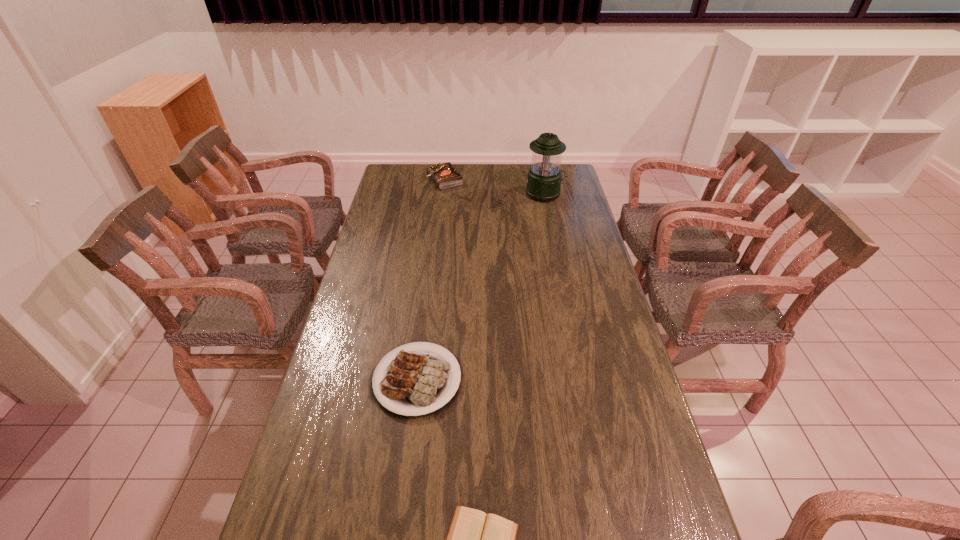
The height and width of the screenshot is (540, 960). In order to click on free point between the third farthest object and the tallest object in this screenshot , I will do `click(481, 287)`.

Where is `unoccupied position between the third shortest object and the third farthest object`? unoccupied position between the third shortest object and the third farthest object is located at coordinates (431, 280).

Where is `free space between the second tallest object and the rightmost object`? This screenshot has width=960, height=540. free space between the second tallest object and the rightmost object is located at coordinates (494, 187).

This screenshot has height=540, width=960. I want to click on object that ranks as the second closest to the lantern, so click(x=416, y=382).

Locate which object ranks third in proximity to the shortest object. Please provide its 2D coordinates. Your answer should be formatted as a tuple, i.e. [(x, y)], where the tuple contains the x and y coordinates of a point satisfying the conditions above.

[(445, 175)]